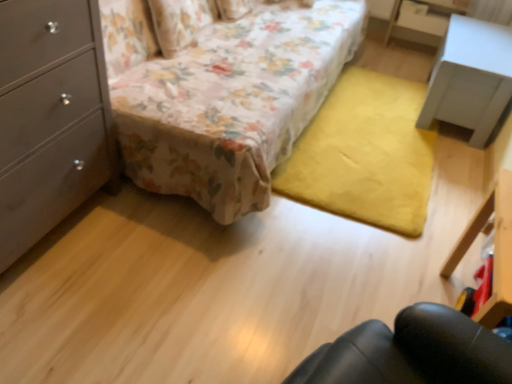
You are a GUI agent. You are given a task and a screenshot of the screen. Output one action in this format:
    pyautogui.click(x=<x>, y=<y>)
    Task: Click on the vacant location behind black plastic vanity at lower right
    
    Given the screenshot: What is the action you would take?
    pyautogui.click(x=397, y=240)